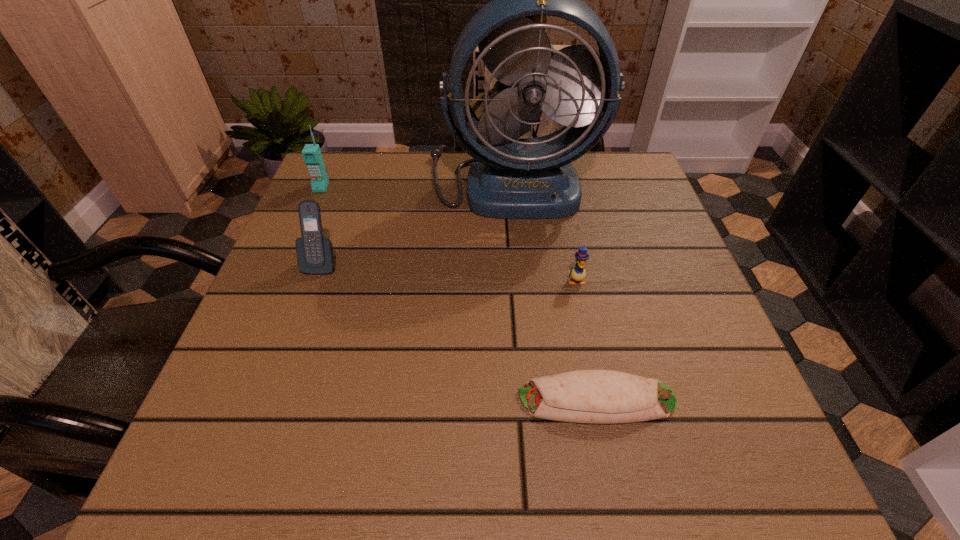
You are a GUI agent. You are given a task and a screenshot of the screen. Output one action in this format:
    pyautogui.click(x=<x>, y=<y>)
    Task: Click on the free spot between the burrito and the leftmost object
    Image resolution: width=960 pixels, height=540 pixels.
    Given the screenshot: What is the action you would take?
    pyautogui.click(x=459, y=294)

This screenshot has width=960, height=540. What are the coordinates of `empty space that is in between the tallest object and the left cellular telephone` in the screenshot? It's located at tap(417, 185).

Locate an element on the screen. Image resolution: width=960 pixels, height=540 pixels. empty space that is in between the right cellular telephone and the tallest object is located at coordinates (417, 222).

Image resolution: width=960 pixels, height=540 pixels. I want to click on vacant area that lies between the shortest object and the left cellular telephone, so click(459, 294).

Identify the location of free space between the second shortest object and the burrito. (587, 340).

The image size is (960, 540). In order to click on vacant point located between the burrito and the fourth tallest object in this screenshot , I will do click(x=587, y=340).

Locate an element on the screen. This screenshot has height=540, width=960. vacant region between the nearest object and the second shortest object is located at coordinates (587, 340).

Locate which object is the closest to the leftmost object. Please provide its 2D coordinates. Your answer should be formatted as a tuple, i.e. [(x, y)], where the tuple contains the x and y coordinates of a point satisfying the conditions above.

[(315, 255)]

Choose which object is the fourth nearest neighbor to the nearest object. Please provide its 2D coordinates. Your answer should be formatted as a tuple, i.e. [(x, y)], where the tuple contains the x and y coordinates of a point satisfying the conditions above.

[(311, 153)]

I want to click on free space in the image that satisfies the following two spatial constraints: 1. on the face of the duckling, where the monocle is placed; 2. at the bitten end of the burrito, so click(600, 400).